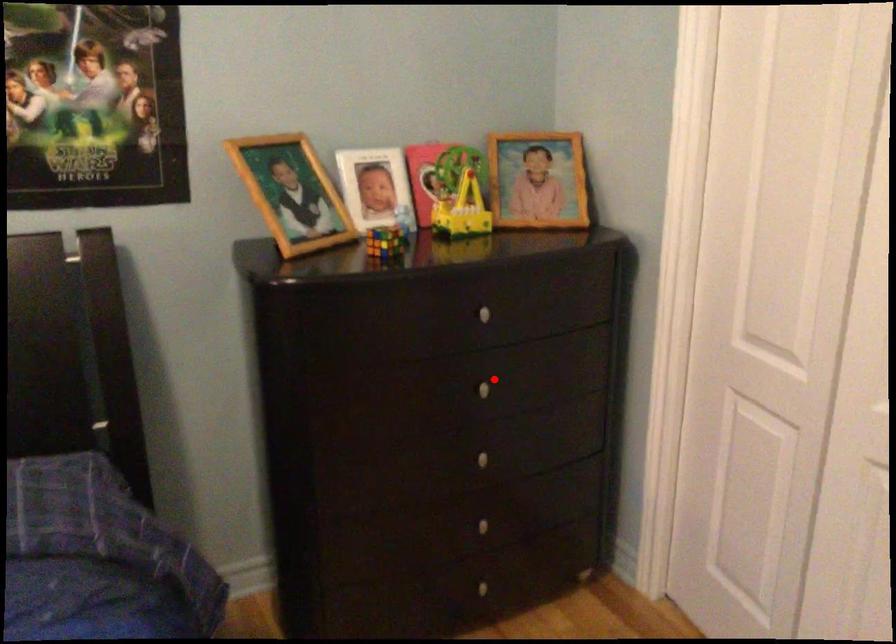
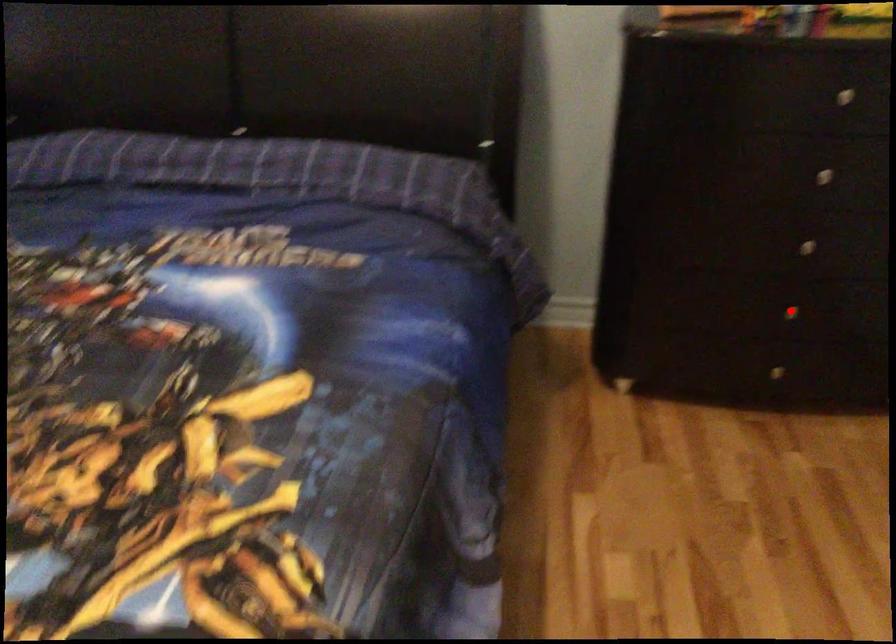
I am providing you with two images of the same scene from different viewpoints. A red point is marked on the first image and another point is marked on the second image. Does the point marked in image1 correspond to the same location as the one in image2?

No